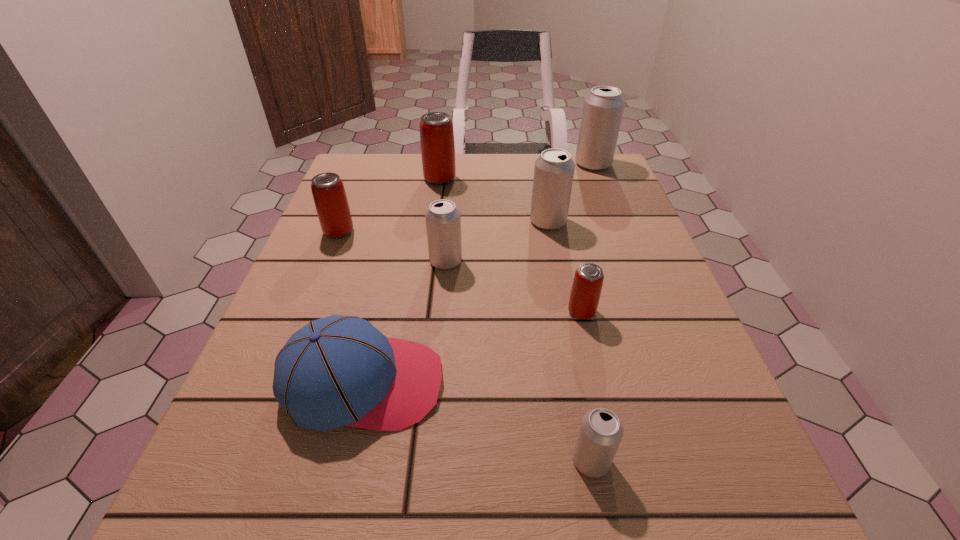
At what (x,y) coordinates should I click in order to perform the action: click on object that stands as the second closest to the nearest white beer can. Please return your answer as a coordinate pair (x, y). This screenshot has width=960, height=540. Looking at the image, I should click on (588, 280).

Identify which object is located as the fifth nearest to the smallest white beer can. Please provide its 2D coordinates. Your answer should be formatted as a tuple, i.e. [(x, y)], where the tuple contains the x and y coordinates of a point satisfying the conditions above.

[(328, 191)]

The width and height of the screenshot is (960, 540). I want to click on the fifth closest beer can to the leftmost pink beer can, so click(603, 107).

Find the location of `beer can that is the sixth closest to the second nearest white beer can`. beer can that is the sixth closest to the second nearest white beer can is located at coordinates (603, 107).

This screenshot has width=960, height=540. Find the location of `the second closest white beer can to the second farthest white beer can`. the second closest white beer can to the second farthest white beer can is located at coordinates (603, 107).

Locate which white beer can ranks in proximity to the rightmost beer can. Please provide its 2D coordinates. Your answer should be formatted as a tuple, i.e. [(x, y)], where the tuple contains the x and y coordinates of a point satisfying the conditions above.

[(554, 169)]

Identify which pink beer can is the third nearest to the farthest white beer can. Please provide its 2D coordinates. Your answer should be formatted as a tuple, i.e. [(x, y)], where the tuple contains the x and y coordinates of a point satisfying the conditions above.

[(328, 191)]

Locate an element on the screen. pink beer can object that ranks as the third closest to the nearest white beer can is located at coordinates (436, 128).

The width and height of the screenshot is (960, 540). In order to click on free space that satisfies the following two spatial constraints: 1. on the front-facing side of the blue baseball cap; 2. on the right side of the nearest beer can in this screenshot , I will do tap(346, 461).

This screenshot has height=540, width=960. In order to click on free spot that satisfies the following two spatial constraints: 1. on the front side of the biggest pink beer can; 2. on the front-facing side of the baseball cap in this screenshot , I will do `click(413, 383)`.